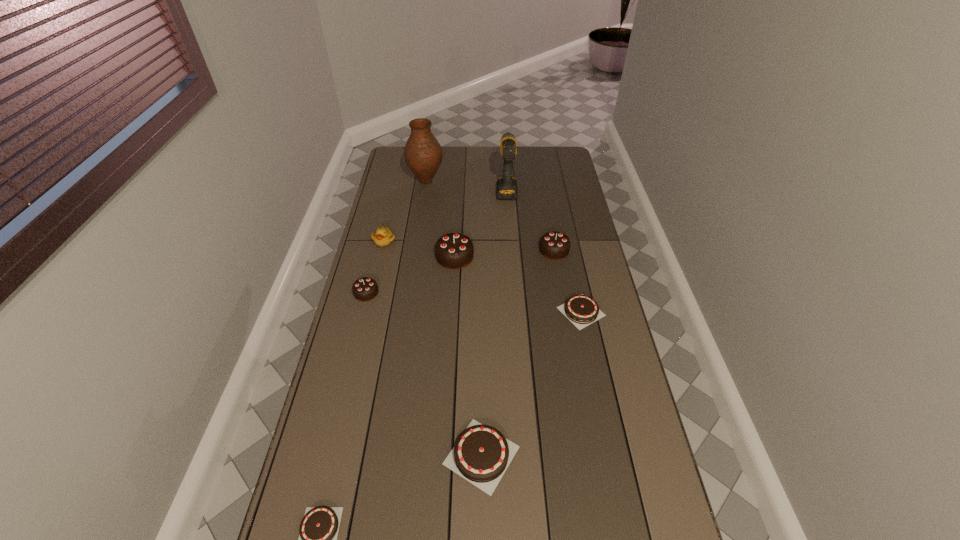
In order to click on vacant area located 0.120m on the right of the leftmost chocolate chocolate cake in this screenshot , I will do `click(412, 293)`.

I want to click on free space located 0.060m on the front of the second nearest object, so click(x=482, y=523).

Find the location of a particular element. free point located on the back of the second shortest chocolate cake is located at coordinates (565, 239).

Image resolution: width=960 pixels, height=540 pixels. Find the location of `object at the far edge`. object at the far edge is located at coordinates (423, 155).

Image resolution: width=960 pixels, height=540 pixels. I want to click on vase present at the left edge, so click(423, 155).

Identify the location of duckling located in the left edge section of the desktop. The height and width of the screenshot is (540, 960). (383, 237).

Find the location of `chocolate cake situated at the left edge`. chocolate cake situated at the left edge is located at coordinates (364, 289).

This screenshot has width=960, height=540. Find the location of `object that is positioned at the far left corner`. object that is positioned at the far left corner is located at coordinates (423, 155).

Identify the location of free space at the far edge. The height and width of the screenshot is (540, 960). (517, 163).

Locate an element on the screen. The height and width of the screenshot is (540, 960). free location at the left edge of the desktop is located at coordinates (343, 431).